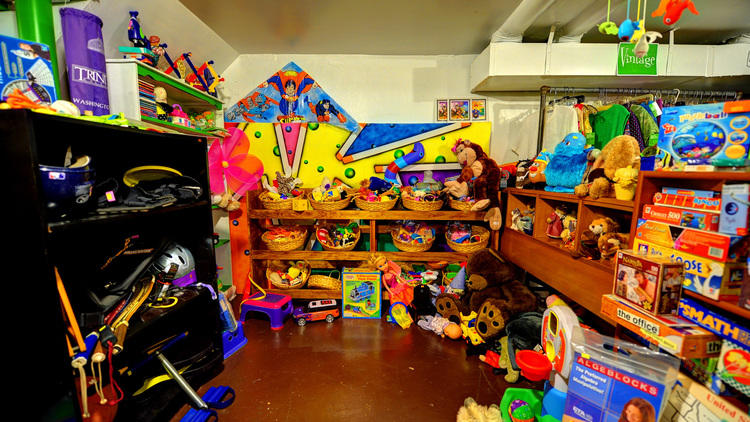
Where is `baskets`? baskets is located at coordinates (280, 201), (322, 201), (378, 203), (430, 201), (292, 240), (346, 245), (411, 243), (454, 242), (292, 284), (314, 284).